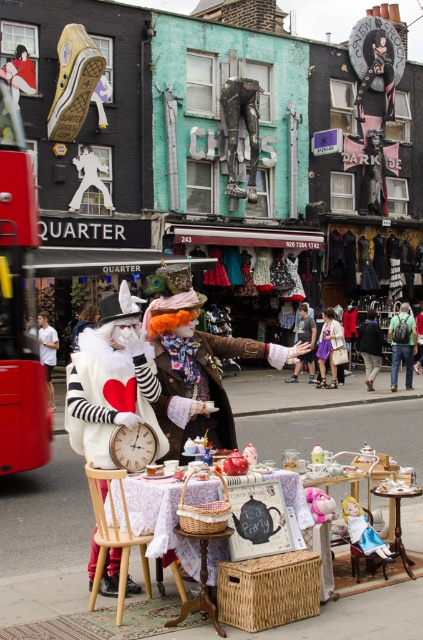
Is the position of wooden table at center less distant than that of white cotton shirt at left?

Yes, it is in front of white cotton shirt at left.

Is point (151, 561) in front of point (46, 372)?

Yes, point (151, 561) is closer to viewer.

Locate an element on the screen. This screenshot has height=640, width=423. wooden table at center is located at coordinates (44, 538).

Is white plush alice at center above matte brown leather jacket at center?

No.

Can you confirm if white plush alice at center is positioned to the right of matte brown leather jacket at center?

In fact, white plush alice at center is to the left of matte brown leather jacket at center.

Who is more distant from viewer, (360, 515) or (307, 323)?

The point (307, 323) is behind.

Locate an element on the screen. This screenshot has width=423, height=640. white plush alice at center is located at coordinates (364, 531).

Measure the distance from wooden table at center to red rubber bus at left.

The distance of wooden table at center from red rubber bus at left is 3.94 meters.

Is point (398, 442) more distant than point (11, 268)?

Yes, point (398, 442) is behind point (11, 268).

At what (x,y) coordinates should I click in order to perform the action: click on wooden table at center. Please return your answer as a coordinate pair (x, y). The width and height of the screenshot is (423, 640). Looking at the image, I should click on (44, 538).